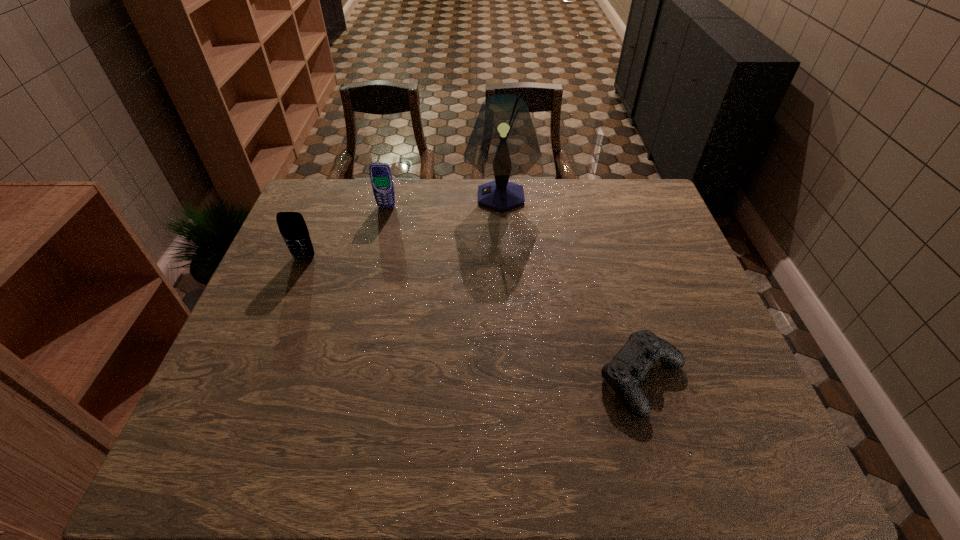
Identify the location of lampshade. (503, 142).

Find the location of a particular element. The image size is (960, 540). the third object from left to right is located at coordinates (503, 142).

Image resolution: width=960 pixels, height=540 pixels. In order to click on the nearer cellular telephone in this screenshot , I will do `click(292, 226)`.

The width and height of the screenshot is (960, 540). I want to click on the left cellular telephone, so click(292, 226).

You are a GUI agent. You are given a task and a screenshot of the screen. Output one action in this format:
    pyautogui.click(x=<x>, y=<y>)
    Task: Click on the farther cellular telephone
    Image resolution: width=960 pixels, height=540 pixels.
    Given the screenshot: What is the action you would take?
    pyautogui.click(x=381, y=177)

You are a GUI agent. You are given a task and a screenshot of the screen. Output one action in this format:
    pyautogui.click(x=<x>, y=<y>)
    Task: Click on the right cellular telephone
    
    Given the screenshot: What is the action you would take?
    pyautogui.click(x=381, y=177)

At what (x,y) coordinates should I click in order to perform the action: click on the rightmost object. Please return your answer as a coordinate pair (x, y). Looking at the image, I should click on (629, 366).

The height and width of the screenshot is (540, 960). In order to click on control in this screenshot , I will do `click(629, 366)`.

Where is `free space located on the base of the lampshade`? The width and height of the screenshot is (960, 540). free space located on the base of the lampshade is located at coordinates tap(372, 197).

The image size is (960, 540). What are the coordinates of `free location located 0.350m on the base of the lampshade` in the screenshot? It's located at (360, 197).